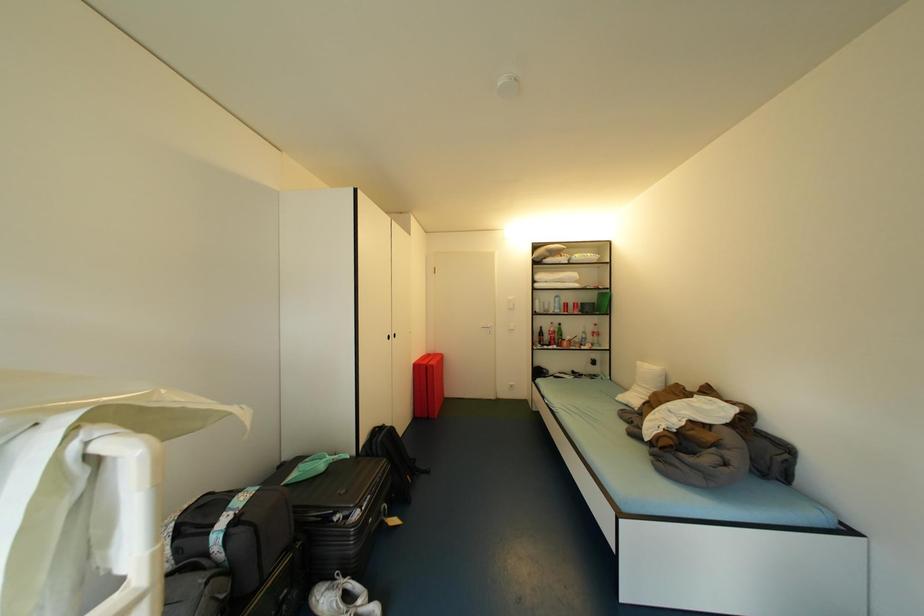
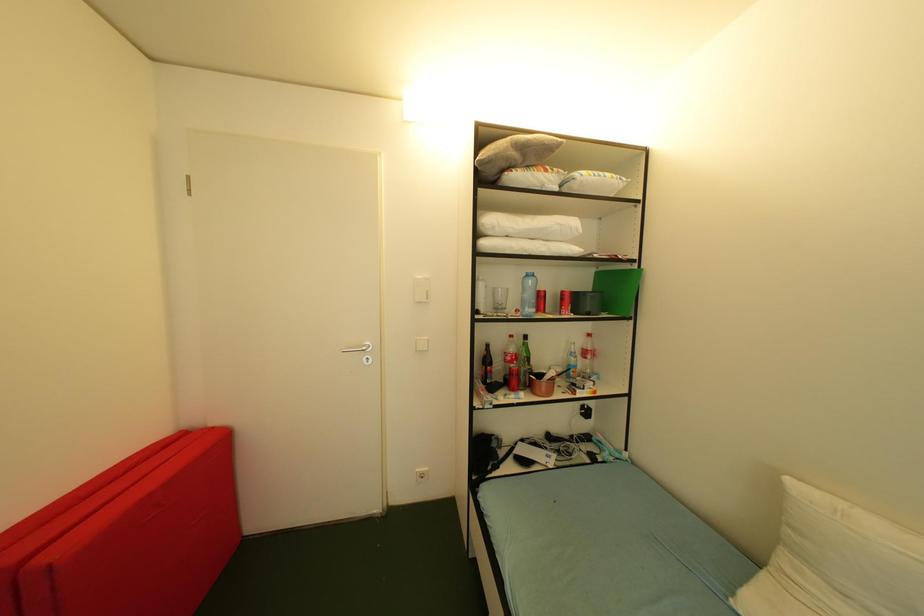
Question: Which direction would the cameraman need to move to produce the second image? Reply with the corresponding letter.

Choices:
 (A) Left
 (B) Right
 (C) Forward
 (D) Backward

Answer: (C)